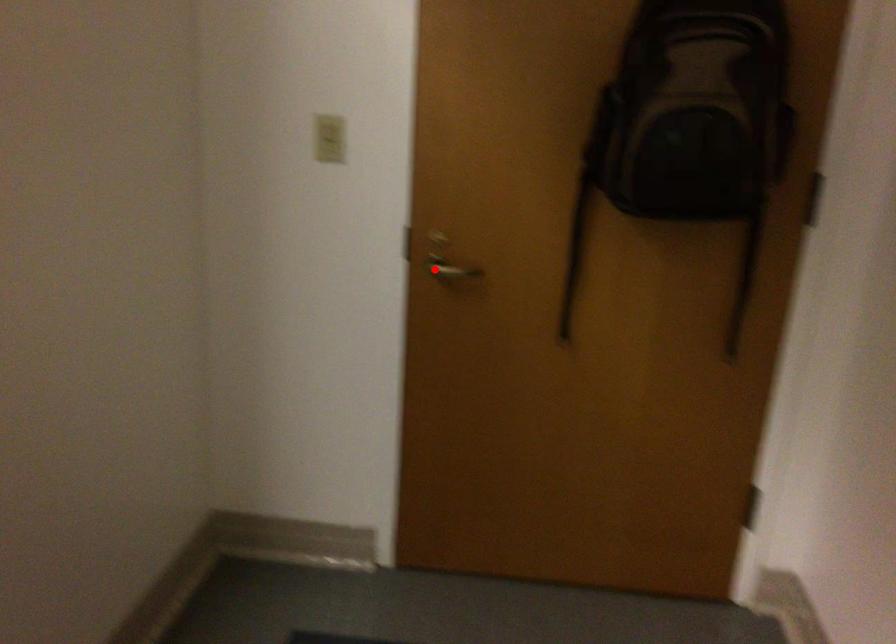
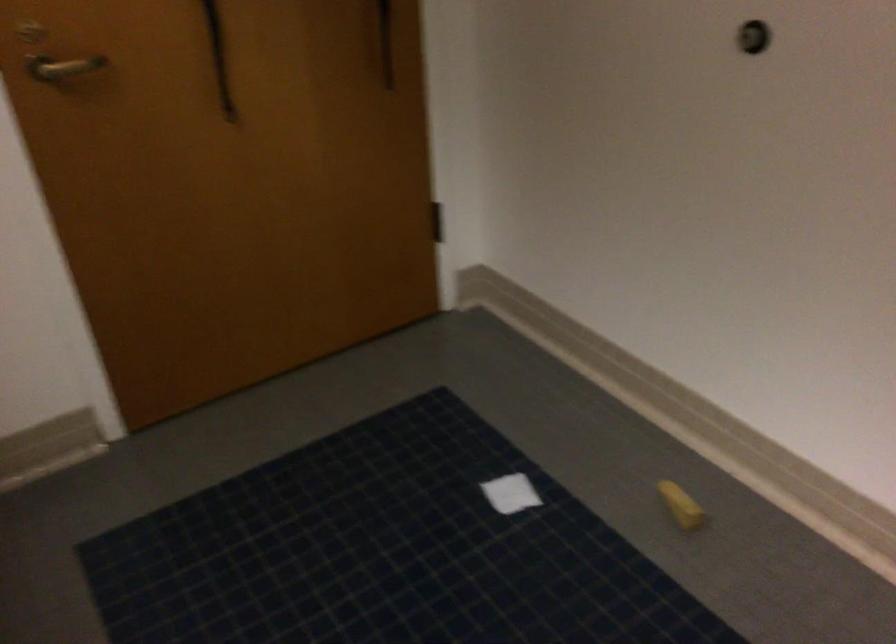
Question: I am providing you with two images of the same scene from different viewpoints. A red point is shown in image1. For the corresponding object point in image2, is it positioned nearer or farther from the camera?

Choices:
 (A) Nearer
 (B) Farther

Answer: (A)